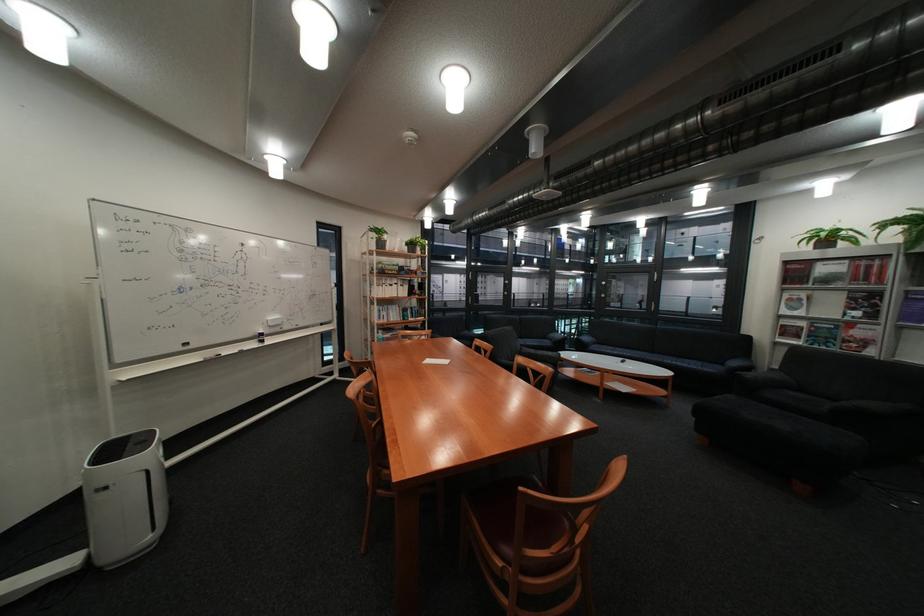
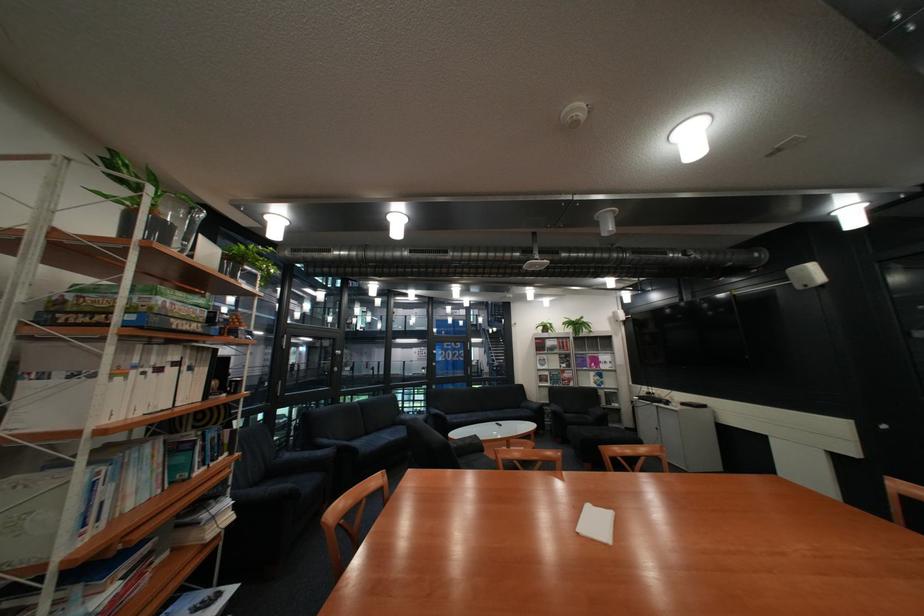
Find the pixel in the second image that matches [589,331] in the first image.

(314, 411)